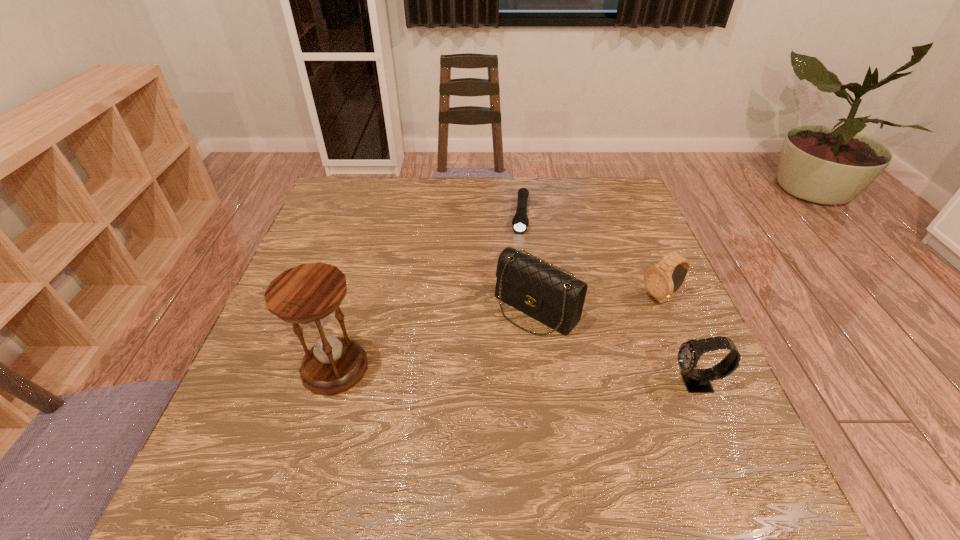
Find the location of a particular element. vacant space that satisfies the following two spatial constraints: 1. on the back side of the clutch bag; 2. on the left side of the farther watch is located at coordinates (535, 299).

I want to click on free space that satisfies the following two spatial constraints: 1. on the back side of the leftmost object; 2. on the right side of the clutch bag, so click(352, 309).